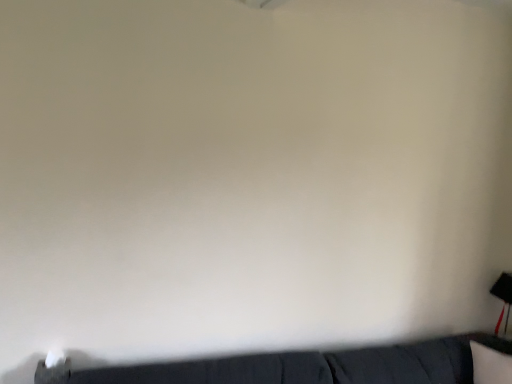
You are a GUI agent. You are given a task and a screenshot of the screen. Output one action in this format:
    pyautogui.click(x=<x>, y=<y>)
    Task: Click on the black fabric table lamp at lower right
    This screenshot has height=384, width=512.
    Given the screenshot: What is the action you would take?
    pyautogui.click(x=503, y=297)

Describe the element at coordinates (503, 297) in the screenshot. This screenshot has height=384, width=512. I see `black fabric table lamp at lower right` at that location.

What are the coordinates of `black fabric table lamp at lower right` in the screenshot? It's located at (503, 297).